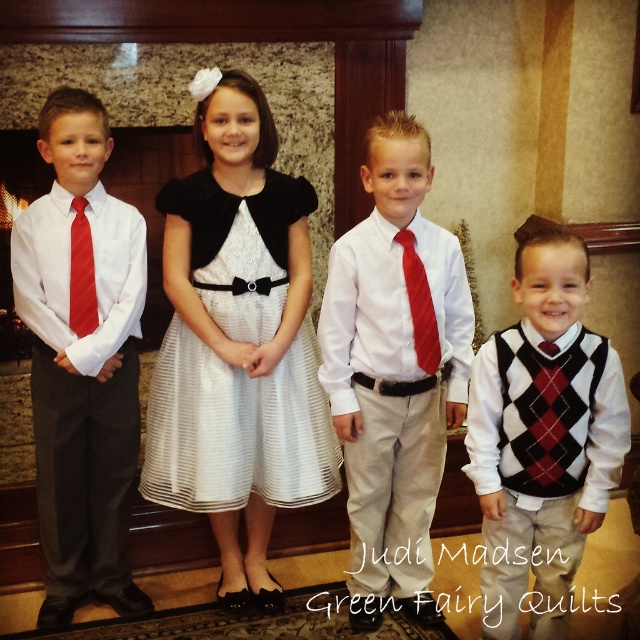
Who is taller, white satin dress at center or red satin tie at center?

white satin dress at center is taller.

Can you confirm if white satin dress at center is positioned to the right of red satin tie at center?

In fact, white satin dress at center is to the left of red satin tie at center.

Is point (227, 196) farther from camera compared to point (412, 285)?

Yes, point (227, 196) is farther from viewer.

At what (x,y) coordinates should I click in order to perform the action: click on white satin dress at center. Please return your answer as a coordinate pair (x, y). The width and height of the screenshot is (640, 640). Looking at the image, I should click on (236, 428).

Can you confirm if matte red tie at center is thinner than matte white shirt at left?

No.

Consider the image. Is matte red tie at center to the right of matte white shirt at left from the viewer's perspective?

Indeed, matte red tie at center is positioned on the right side of matte white shirt at left.

The height and width of the screenshot is (640, 640). I want to click on matte red tie at center, so click(394, 371).

Identify the location of matte white shirt at left. Image resolution: width=640 pixels, height=640 pixels. (x=81, y=356).

Does matte white shirt at left have a smaller size compared to white satin dress at center?

No, matte white shirt at left is not smaller than white satin dress at center.

Which is in front, point (51, 161) or point (298, 346)?

Point (51, 161)

Where is `matte white shirt at left`? matte white shirt at left is located at coordinates pyautogui.click(x=81, y=356).